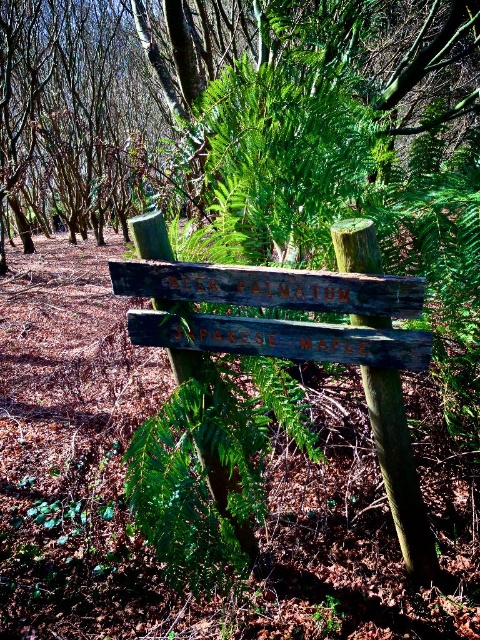
Who is positioned more to the left, green wood sign at center or weathered wood sign at center?

From the viewer's perspective, green wood sign at center appears more on the left side.

In the scene shown: Who is positioned more to the right, green wood sign at center or weathered wood sign at center?

From the viewer's perspective, weathered wood sign at center appears more on the right side.

You are a GUI agent. You are given a task and a screenshot of the screen. Output one action in this format:
    pyautogui.click(x=<x>, y=<y>)
    Task: Click on the green wood sign at center
    
    Given the screenshot: What is the action you would take?
    pyautogui.click(x=218, y=108)

The width and height of the screenshot is (480, 640). I want to click on green wood sign at center, so click(218, 108).